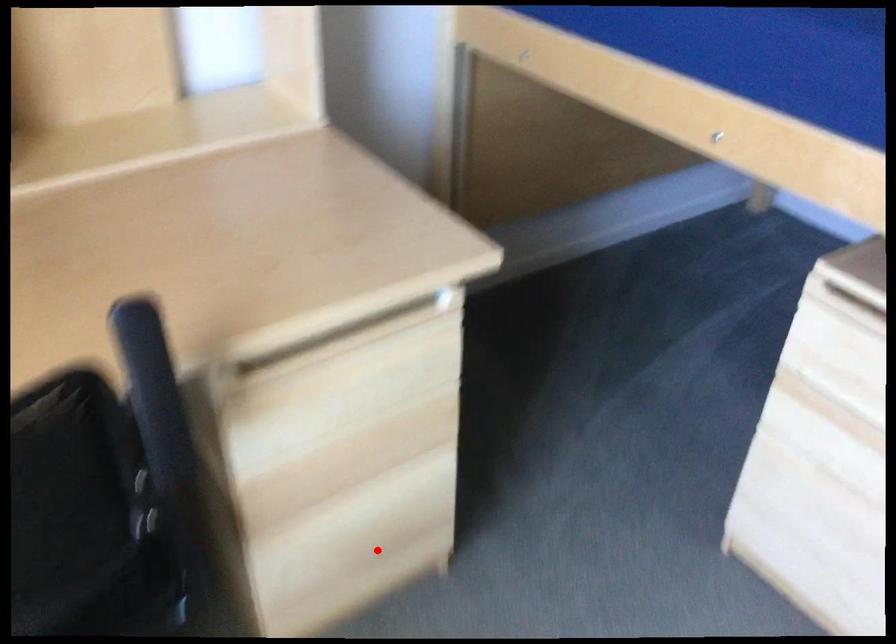
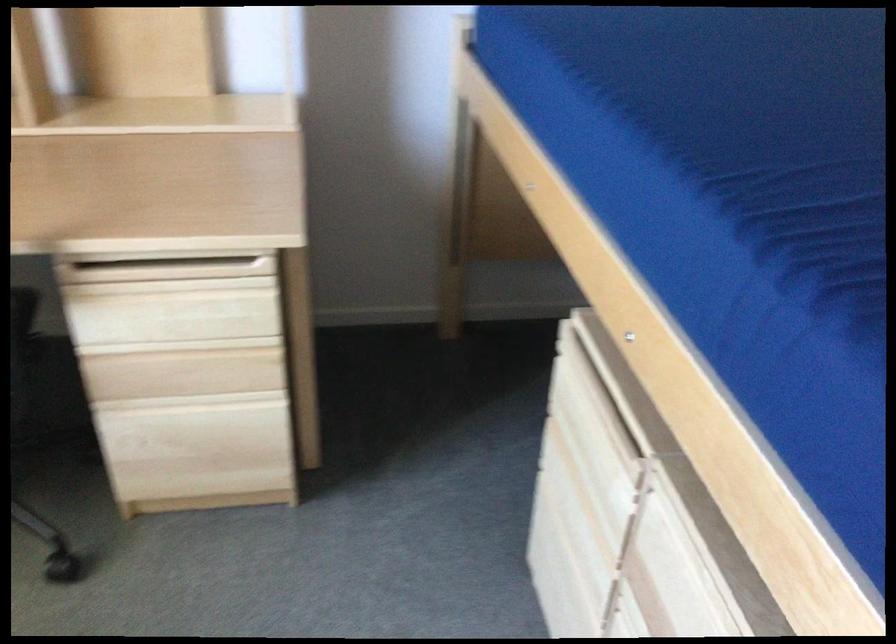
Question: I am providing you with two images of the same scene from different viewpoints. Image1 has a red point marked. In image2, the corresponding 3D location appears at what relative position? Reply with the corresponding letter.

Choices:
 (A) Closer
 (B) Farther

Answer: (B)